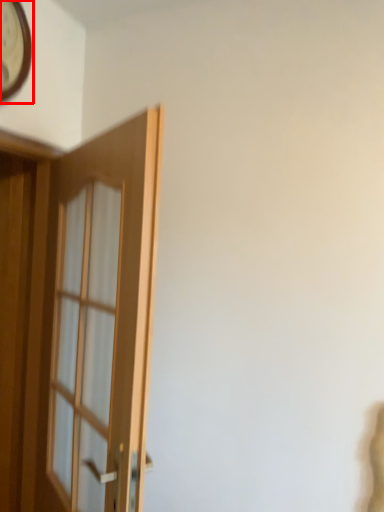
Question: From the image's perspective, what is the correct spatial positioning of clock (annotated by the red box) in reference to door?

Choices:
 (A) below
 (B) above

Answer: (B)